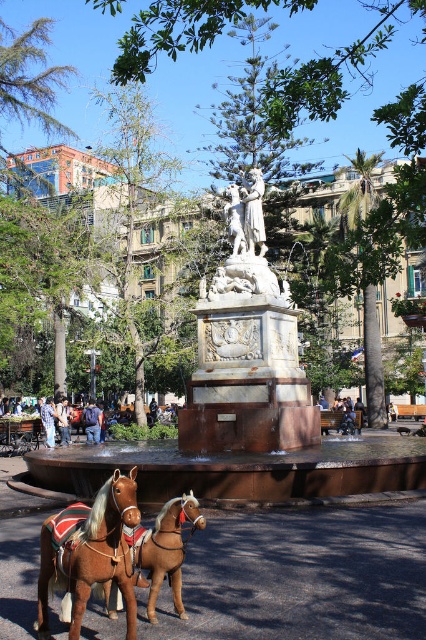
Question: Is blue fabric backpack at center bigger than denim jacket at lower right?

Choices:
 (A) no
 (B) yes

Answer: (B)

Question: Can you confirm if blue fabric backpack at center is positioned above denim jacket at lower right?

Choices:
 (A) yes
 (B) no

Answer: (B)

Question: Which point is farther to the camera?

Choices:
 (A) (204, 404)
 (B) (43, 428)

Answer: (B)

Question: Which point appears closest to the camera in this image?

Choices:
 (A) (158, 554)
 (B) (123, 588)

Answer: (B)

Question: Which point appears closest to the camera in this image?

Choices:
 (A) (238, 330)
 (B) (167, 548)
 (C) (97, 419)
 (D) (48, 429)

Answer: (B)

Question: Does brown leather horse at lower center appear under blue fabric backpack at center?

Choices:
 (A) yes
 (B) no

Answer: (B)